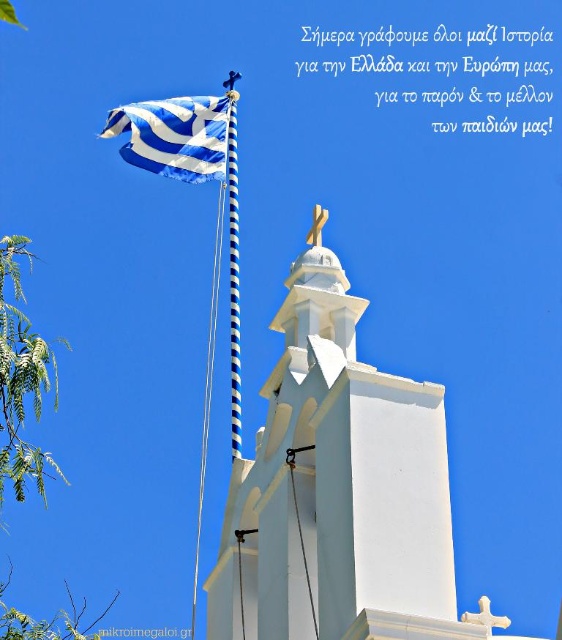
From the picture: You are an artist trying to paint the scene. You notice the blue and white striped flag at upper left and the blue striped pole at upper center. Which object should you make wider in your painting to stay true to the original image?

The blue and white striped flag at upper left should be made wider in the painting since its width is larger than the blue striped pole at upper center.

Based on the scene description, where is the white smooth tower at center located in the image?

The white smooth tower at center is located at point (334,483) in the image.

You are standing in front of the church and want to take a photo of two specific points marked in the scene. The first point is at coordinates point (x=151, y=161) and the second is at point (x=235, y=109). Which point will appear larger in your photo?

Point (x=151, y=161) is closer to the camera than point (x=235, y=109), so it will appear larger in the photo.